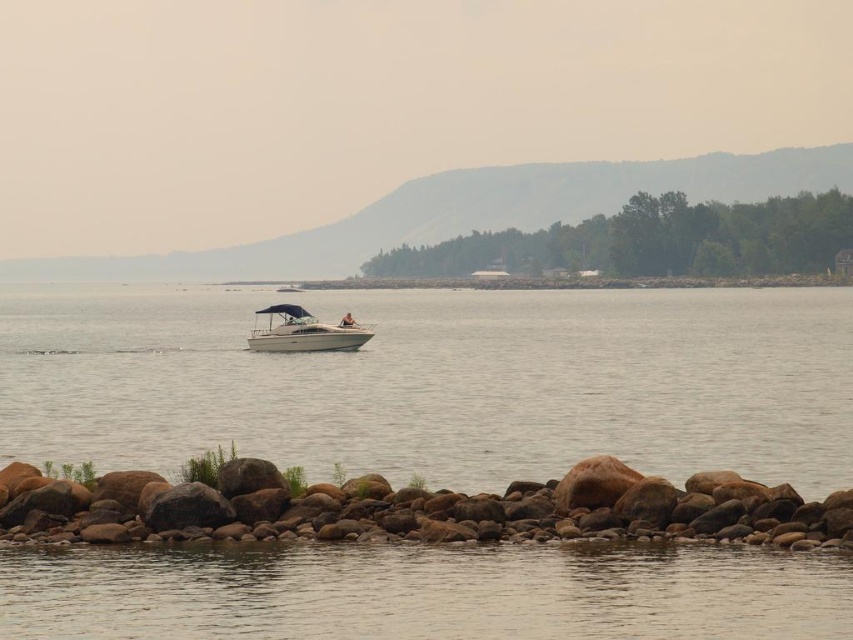
Question: Which point is closer to the camera?

Choices:
 (A) (358, 470)
 (B) (334, 342)

Answer: (A)

Question: Does clear water at center appear over white glossy boat at center?

Choices:
 (A) yes
 (B) no

Answer: (A)

Question: Can you confirm if clear water at center is positioned above brown rock at lower center?

Choices:
 (A) yes
 (B) no

Answer: (A)

Question: Which point is farther from the camera taking this photo?

Choices:
 (A) (288, 332)
 (B) (331, 317)
 (C) (392, 512)

Answer: (B)

Question: Which point is farther from the camera taking this photo?

Choices:
 (A) tap(711, 480)
 (B) tap(312, 326)

Answer: (B)

Question: Does brown rock at lower center appear under white glossy boat at center?

Choices:
 (A) yes
 (B) no

Answer: (A)